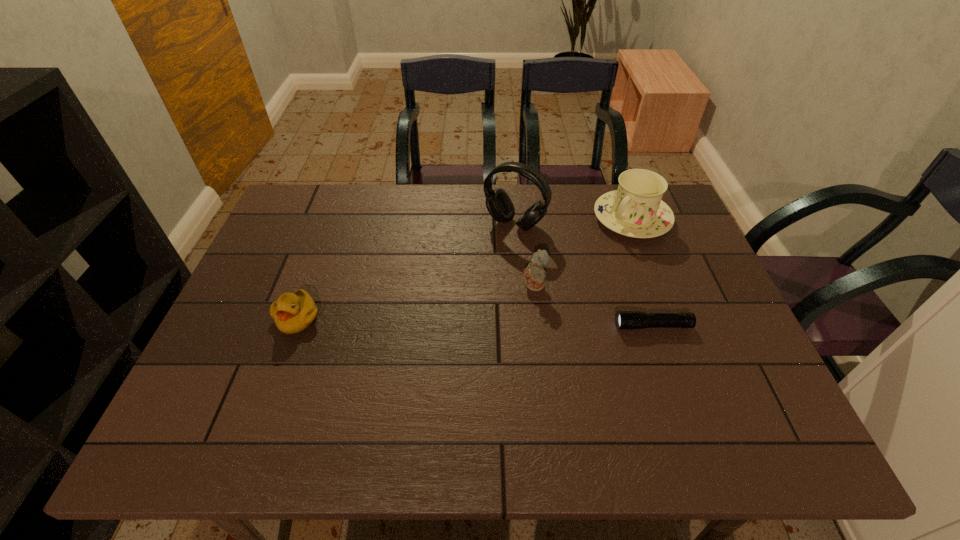
What are the coordinates of `empty location between the chinaware and the fourth tallest object` in the screenshot? It's located at (465, 268).

Find the location of a particular element. blank region between the duckling and the headset is located at coordinates (406, 271).

The height and width of the screenshot is (540, 960). What are the coordinates of `free spot between the tallest object and the flashlight` in the screenshot? It's located at (584, 275).

Locate an element on the screen. Image resolution: width=960 pixels, height=540 pixels. blank region between the duckling and the headset is located at coordinates (406, 271).

This screenshot has width=960, height=540. Identify the location of empty location between the teddy bear and the duckling. (416, 302).

Identify the location of vacant area between the leftmost object and the third nearest object. (416, 302).

Where is `vacant space that's between the teddy bear and the flashlight`? The image size is (960, 540). vacant space that's between the teddy bear and the flashlight is located at coordinates (593, 306).

Where is `free spot between the tallest object and the flashlight`? The height and width of the screenshot is (540, 960). free spot between the tallest object and the flashlight is located at coordinates (584, 275).

At what (x,y) coordinates should I click in order to perform the action: click on free space between the teddy bear and the flashlight. Please return your answer as a coordinate pair (x, y). The width and height of the screenshot is (960, 540). Looking at the image, I should click on (593, 306).

In order to click on free space between the chinaware and the tallest object in this screenshot , I will do `click(573, 221)`.